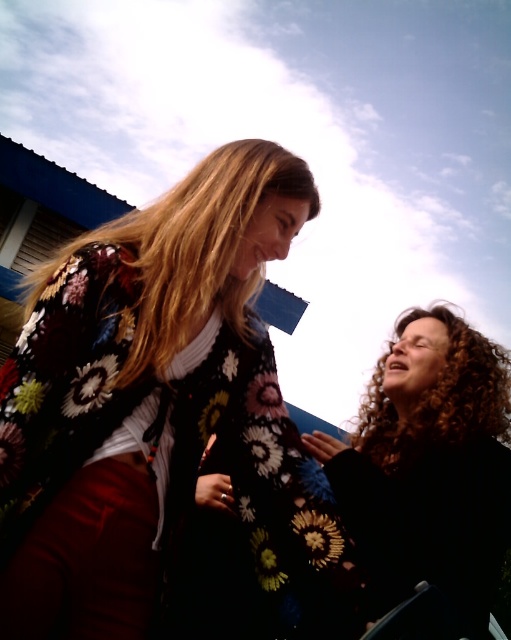
What is the color of the hair of the person located at the coordinates point (429, 465)?

The point (429, 465) indicates black curly hair at right.